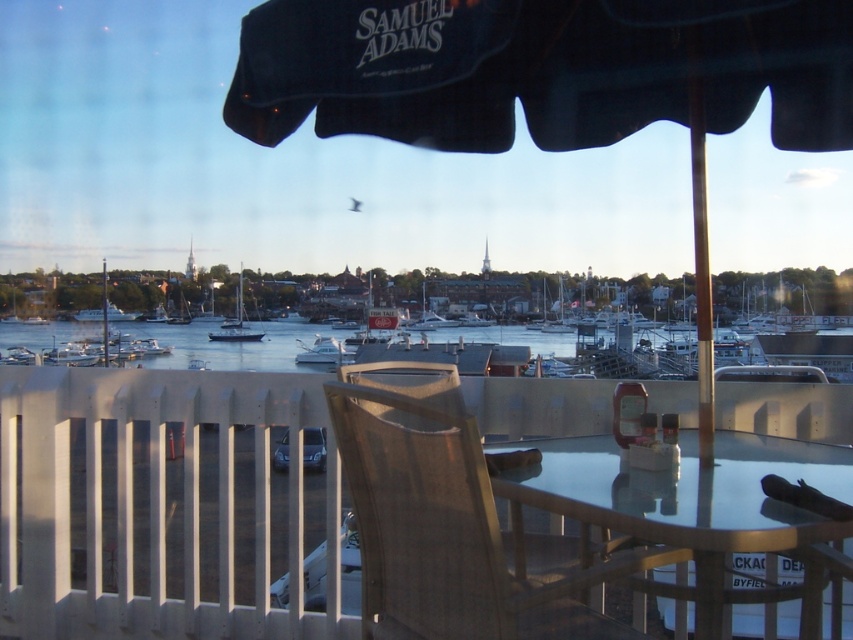
You are standing on the balcony and want to take a photo of the white matte boat at center without the transparent glass table at center blocking the view. Is this possible?

The transparent glass table at center is closer to the viewer than the white matte boat at center, so the glass table may partially block the view of the boat. However, since the table is transparent, you might still see the boat through it, but the clarity and obstruction depend on the table material and angle.

You are a guest at this waterfront dining area and want to place your phone on the table without it being too close to the edge. Considering the sizes of the wooden railing at lower center and transparent glass table at center, which object provides a more stable and spacious surface for placing your phone?

The transparent glass table at center is smaller than the wooden railing at lower center. However, the railing is not a flat surface for placing items. The glass table, despite being smaller, is designed for placing objects and offers a stable surface. Therefore, you should place your phone on the transparent glass table at center.